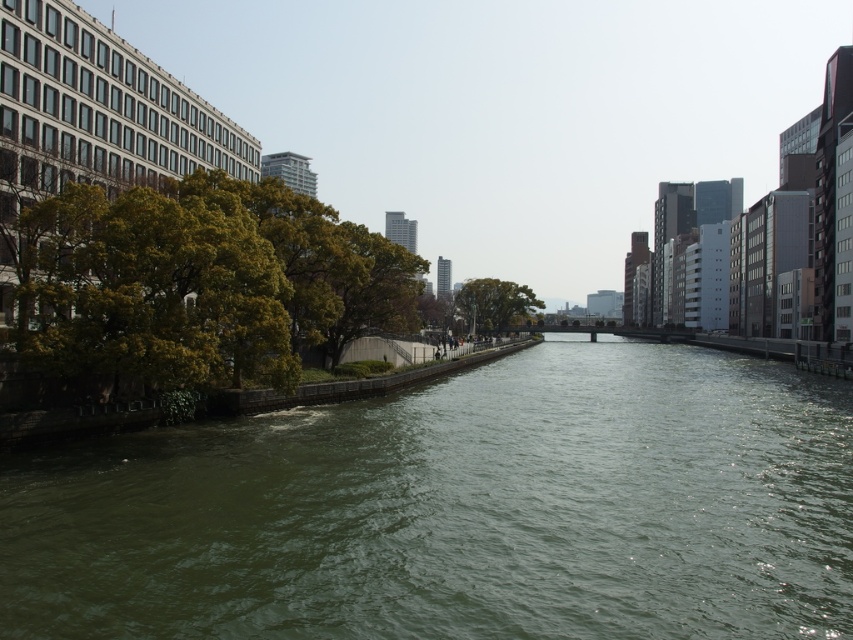
Which is more to the left, green water at center or green leafy tree at left?

green leafy tree at left

At what (x,y) coordinates should I click in order to perform the action: click on green water at center. Please return your answer as a coordinate pair (x, y). Image resolution: width=853 pixels, height=640 pixels. Looking at the image, I should click on (457, 509).

Image resolution: width=853 pixels, height=640 pixels. In order to click on green water at center in this screenshot , I will do `click(457, 509)`.

Can you confirm if green water at center is smaller than green leafy tree at center?

Yes.

Which is behind, point (1, 499) or point (496, 289)?

The point (496, 289) is more distant.

Does point (743, 360) come farther from viewer compared to point (463, 304)?

That is False.

Image resolution: width=853 pixels, height=640 pixels. What are the coordinates of `green water at center` in the screenshot? It's located at (457, 509).

Is green leafy tree at left further to camera compared to green leafy tree at center?

No, green leafy tree at left is closer to the viewer.

Does green leafy tree at left appear on the right side of green leafy tree at center?

In fact, green leafy tree at left is to the left of green leafy tree at center.

Locate an element on the screen. The height and width of the screenshot is (640, 853). green leafy tree at left is located at coordinates (200, 282).